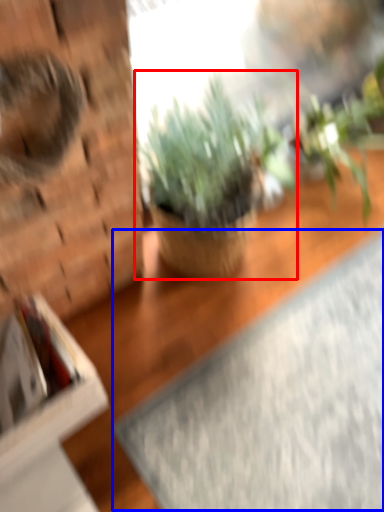
Question: Which object appears closest to the camera in this image, houseplant (highlighted by a red box) or yoga mat (highlighted by a blue box)?

Choices:
 (A) houseplant
 (B) yoga mat

Answer: (A)